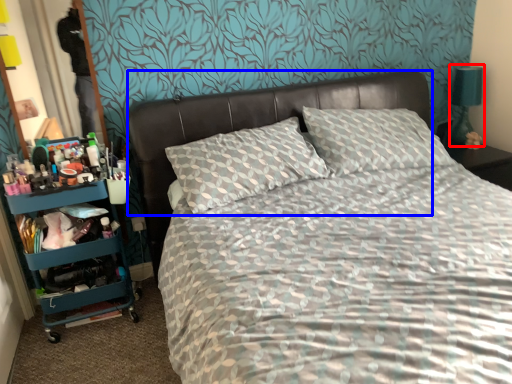
Question: Which of the following is the closest to the observer, bedside lamp (highlighted by a red box) or headboard (highlighted by a blue box)?

Choices:
 (A) bedside lamp
 (B) headboard

Answer: (B)